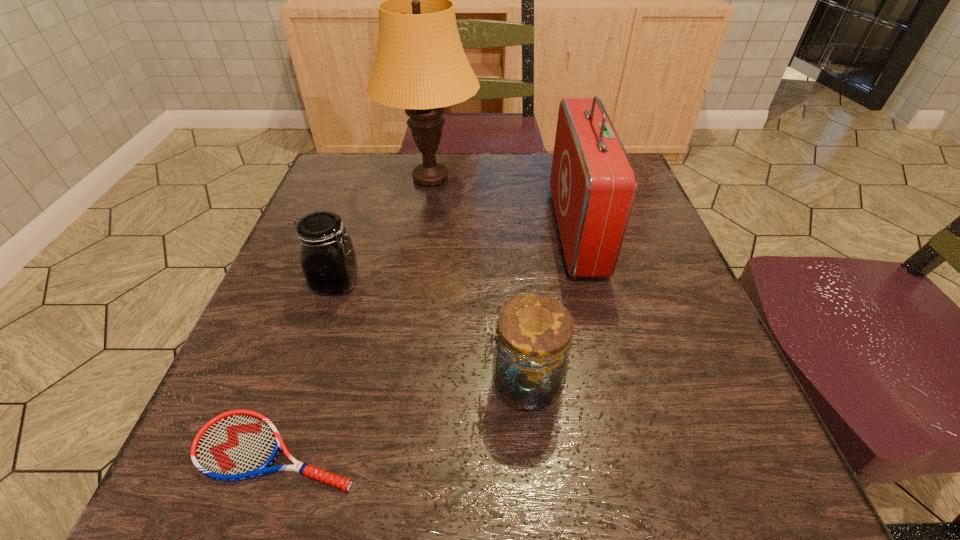
In the image, there is a desktop. Where is `vacant space at the far left corner`? vacant space at the far left corner is located at coordinates (348, 204).

I want to click on free region at the near left corner, so click(x=276, y=490).

Image resolution: width=960 pixels, height=540 pixels. I want to click on free space between the rightmost object and the farther jar, so click(x=457, y=257).

Find the location of a particular element. The image size is (960, 540). vacant space in between the lampshade and the shortest object is located at coordinates (354, 315).

I want to click on free space between the rightmost object and the tallest object, so click(504, 205).

Find the location of a particular element. vacant area between the right jar and the tennis racket is located at coordinates (400, 417).

I want to click on free spot between the second object from right to left and the shortest object, so click(x=400, y=417).

Identify the location of vacant area that lies between the shortest object and the rightmost object. The width and height of the screenshot is (960, 540). pos(426,341).

Identify the location of free point between the fourth shortest object and the tennis racket. This screenshot has height=540, width=960. (426, 341).

At what (x,y) coordinates should I click in order to perform the action: click on free space between the shortest object and the right jar. Please return your answer as a coordinate pair (x, y). The width and height of the screenshot is (960, 540). Looking at the image, I should click on (400, 417).